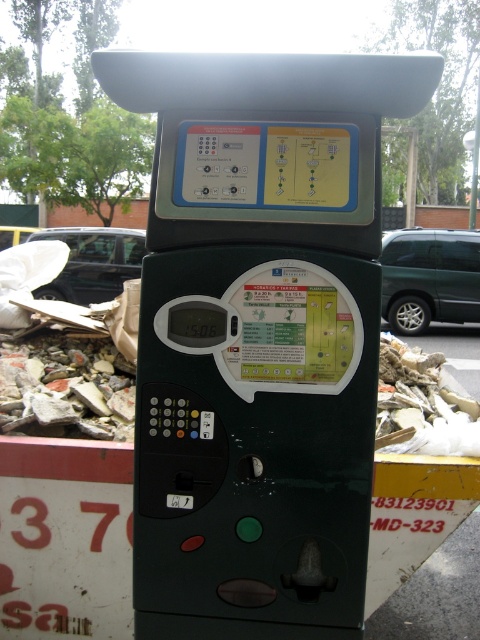
Question: Which of these objects is positioned farthest from the green matte van at right?

Choices:
 (A) green matte parking meter at center
 (B) metallic silver car at left

Answer: (A)

Question: Is green matte van at right in front of metallic silver car at left?

Choices:
 (A) no
 (B) yes

Answer: (A)

Question: Does green matte parking meter at center come behind green matte van at right?

Choices:
 (A) yes
 (B) no

Answer: (B)

Question: Which point appears closest to the camera in this image?

Choices:
 (A) (80, 252)
 (B) (334, 296)

Answer: (B)

Question: From the image, what is the correct spatial relationship of green matte parking meter at center in relation to metallic silver car at left?

Choices:
 (A) below
 (B) above

Answer: (A)

Question: Which object is farther from the camera taking this photo?

Choices:
 (A) green matte parking meter at center
 (B) green matte van at right

Answer: (B)